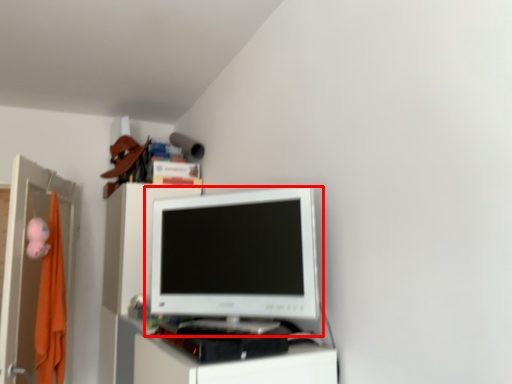
Question: From the image's perspective, considering the relative positions of computer monitor (annotated by the red box) and file cabinet in the image provided, where is computer monitor (annotated by the red box) located with respect to the staircase?

Choices:
 (A) below
 (B) above

Answer: (B)